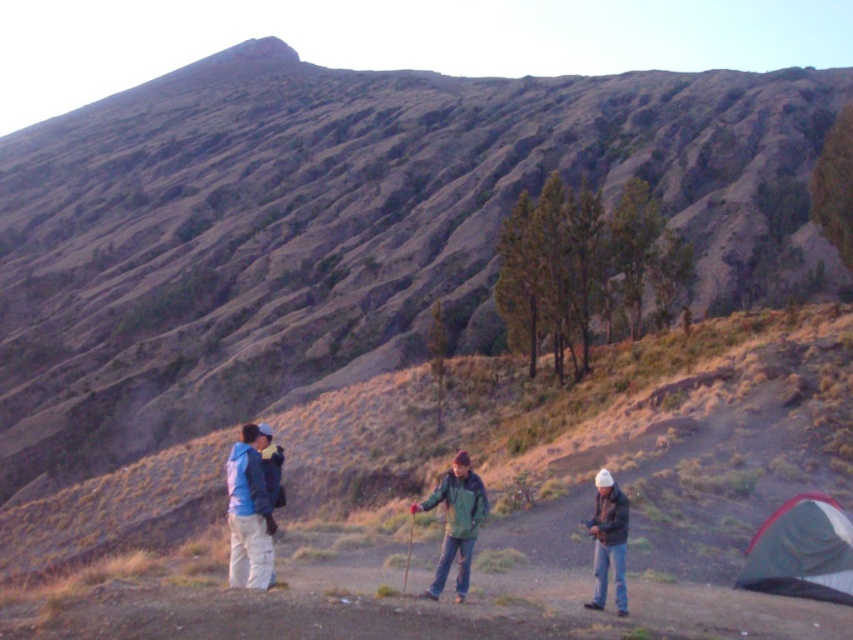
Between point (260, 561) and point (611, 557), which one is positioned behind?

The point (611, 557) is behind.

Between brushed metal jacket at lower left and white matte jacket at lower right, which one appears on the left side from the viewer's perspective?

From the viewer's perspective, brushed metal jacket at lower left appears more on the left side.

Does point (241, 564) come closer to viewer compared to point (622, 515)?

Yes.

Find the location of a particular element. Image resolution: width=853 pixels, height=640 pixels. brushed metal jacket at lower left is located at coordinates (248, 515).

Who is positioned more to the left, green fabric tent at lower right or white matte jacket at lower right?

Positioned to the left is white matte jacket at lower right.

Is point (746, 572) closer to camera compared to point (595, 592)?

That is False.

Find the location of `green fabric tent at lower right`. green fabric tent at lower right is located at coordinates (801, 552).

Is green fabric tent at lower right bigger than brushed metal jacket at lower left?

Actually, green fabric tent at lower right might be smaller than brushed metal jacket at lower left.

Can you confirm if green fabric tent at lower right is smaller than brushed metal jacket at lower left?

Yes.

Between point (786, 566) and point (233, 577), which one is positioned behind?

The point (786, 566) is behind.

You are a GUI agent. You are given a task and a screenshot of the screen. Output one action in this format:
    pyautogui.click(x=<x>, y=<y>)
    Task: Click on the green fabric tent at lower right
    The width and height of the screenshot is (853, 640).
    Given the screenshot: What is the action you would take?
    [801, 552]